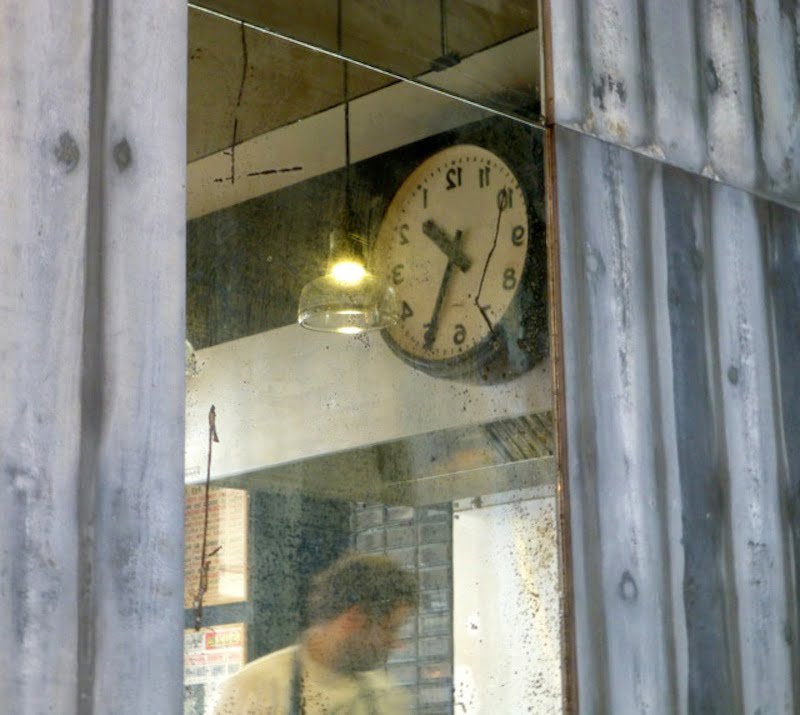
This screenshot has height=715, width=800. What are the coordinates of `light` in the screenshot? It's located at (342, 271).